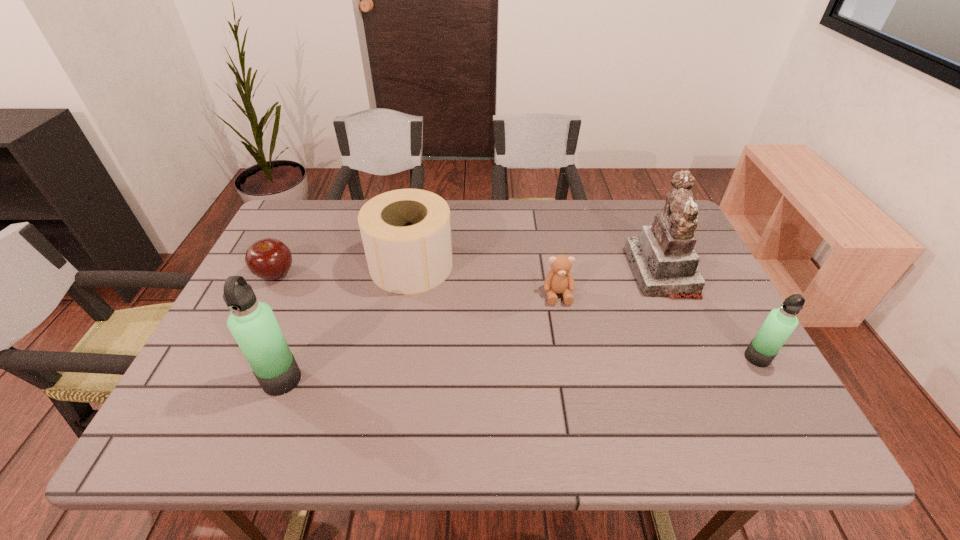
Locate an element on the screen. free space located on the left of the toilet tissue is located at coordinates (320, 265).

This screenshot has width=960, height=540. Identify the location of free point located 0.190m on the face of the third object from right to left. (571, 368).

Where is `free location located 0.390m on the front-facing side of the figurine`? The height and width of the screenshot is (540, 960). free location located 0.390m on the front-facing side of the figurine is located at coordinates (492, 272).

Locate an element on the screen. This screenshot has height=540, width=960. free region located on the front-facing side of the figurine is located at coordinates (520, 272).

Identify the location of free region located 0.310m on the front-facing side of the figurine. Image resolution: width=960 pixels, height=540 pixels. (520, 272).

Find the location of a particular element. This screenshot has width=960, height=540. vacant space located on the front of the apple is located at coordinates (257, 310).

At what (x,y) coordinates should I click in order to perform the action: click on object that is positioned at the far edge. Please return your answer as a coordinate pair (x, y). The height and width of the screenshot is (540, 960). Looking at the image, I should click on (406, 233).

This screenshot has width=960, height=540. In order to click on object situated at the near edge in this screenshot , I will do tap(253, 324).

This screenshot has height=540, width=960. What are the coordinates of `thermos bottle present at the left edge` in the screenshot? It's located at (253, 324).

You are a GUI agent. You are given a task and a screenshot of the screen. Output one action in this format:
    pyautogui.click(x=<x>, y=<y>)
    Task: Click on the apple located in the left edge section of the desktop
    
    Given the screenshot: What is the action you would take?
    pyautogui.click(x=270, y=259)